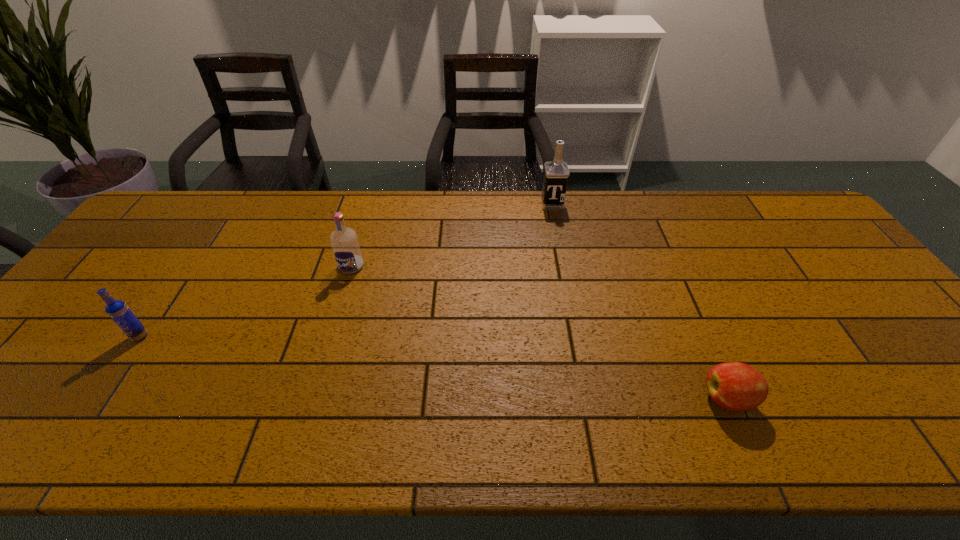
Locate an element on the screen. free spot located on the right of the third farthest object is located at coordinates (196, 336).

This screenshot has height=540, width=960. In order to click on free region located 0.070m on the left of the shortest object in this screenshot , I will do click(x=672, y=399).

Image resolution: width=960 pixels, height=540 pixels. In order to click on object located at the far edge in this screenshot , I will do point(556,172).

You are a GUI agent. You are given a task and a screenshot of the screen. Output one action in this format:
    pyautogui.click(x=<x>, y=<y>)
    Task: Click on the object that is positioned at the near edge
    The height and width of the screenshot is (540, 960).
    Given the screenshot: What is the action you would take?
    pyautogui.click(x=735, y=386)

The image size is (960, 540). What are the coordinates of `vacant space at the far edge` in the screenshot? It's located at (229, 205).

Identify the location of free space at the near edge of the desktop. (270, 447).

This screenshot has width=960, height=540. What are the coordinates of `free space at the left edge of the desktop` in the screenshot? It's located at (51, 377).

You are a GUI agent. You are given a task and a screenshot of the screen. Output one action in this format:
    pyautogui.click(x=<x>, y=<y>)
    Task: Click on the vacant space at the right edge of the desktop
    This screenshot has height=540, width=960.
    Given the screenshot: What is the action you would take?
    pyautogui.click(x=890, y=383)

The height and width of the screenshot is (540, 960). Find the location of `vacant space at the far right corner`. vacant space at the far right corner is located at coordinates click(756, 195).

Where is `free space between the second farthest vodka and the nearest object`? Image resolution: width=960 pixels, height=540 pixels. free space between the second farthest vodka and the nearest object is located at coordinates (540, 333).